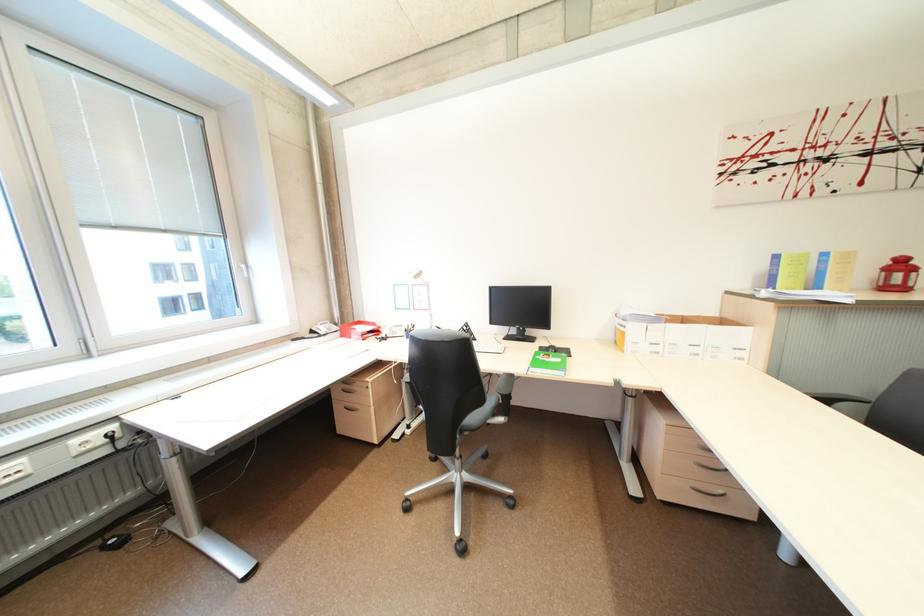
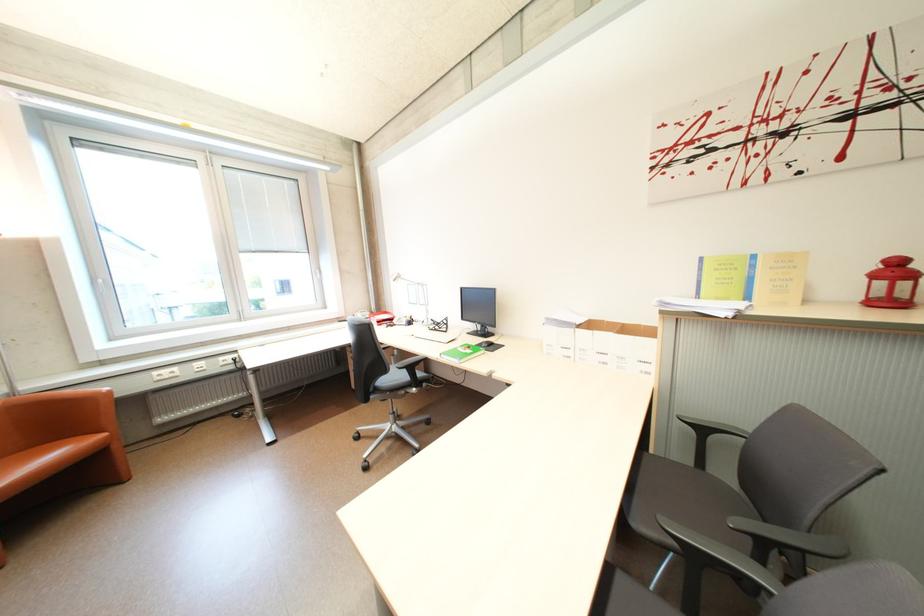
Question: Which direction would the cameraman need to move to produce the second image? Reply with the corresponding letter.

Choices:
 (A) Left
 (B) Right
 (C) Forward
 (D) Backward

Answer: (B)